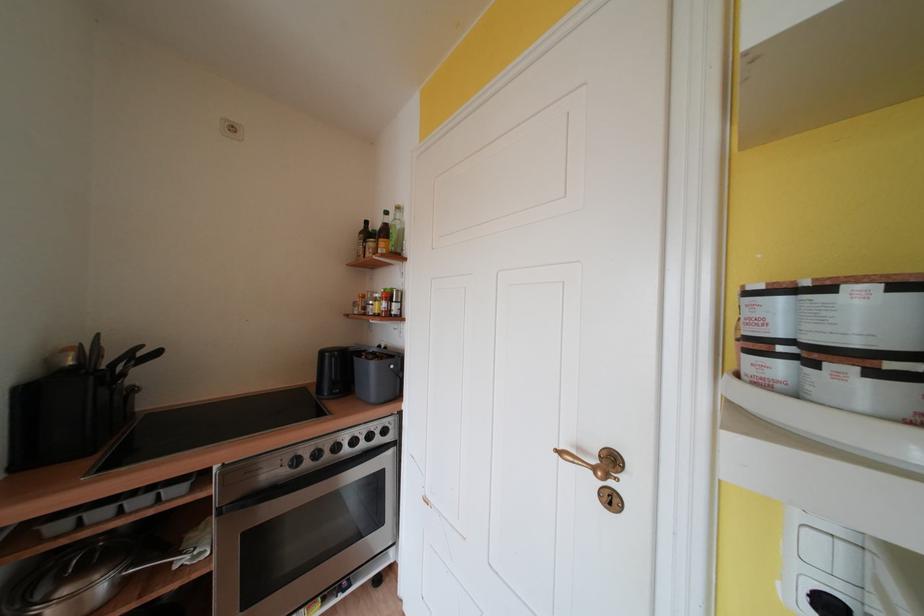
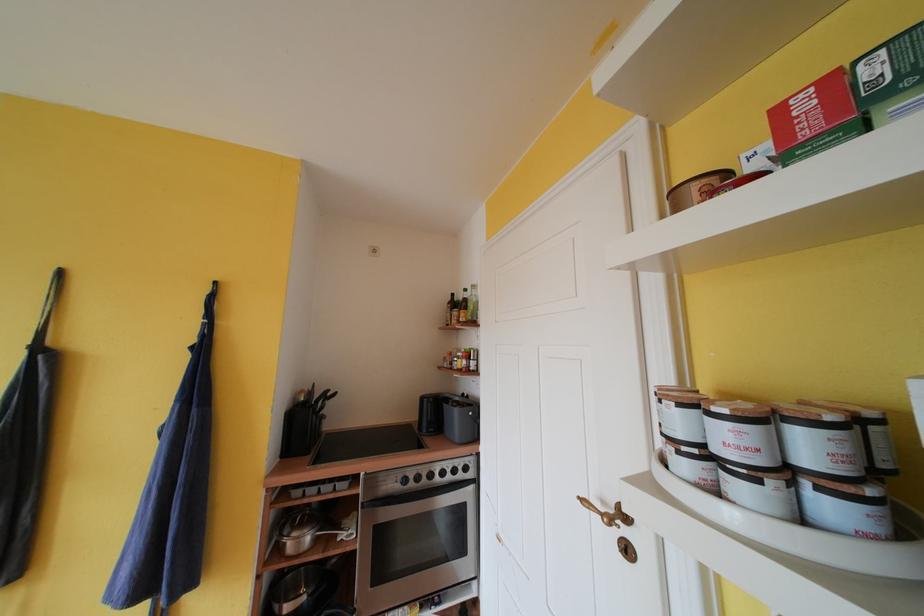
The point at (x=393, y=216) is marked in the first image. Where is the corresponding point in the second image?

(471, 294)